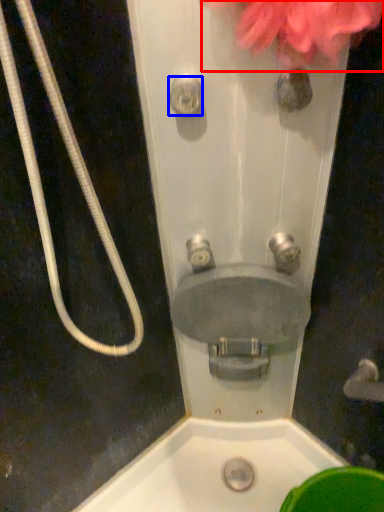
Question: Which of the following is the farthest to the observer, flower (highlighted by a red box) or shower (highlighted by a blue box)?

Choices:
 (A) flower
 (B) shower

Answer: (B)